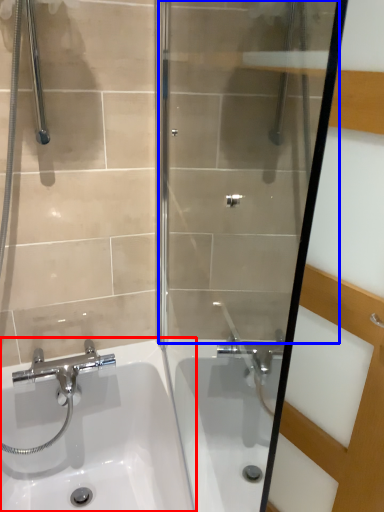
Question: Which object is further to the camera taking this photo, sink (highlighted by a red box) or shower door (highlighted by a blue box)?

Choices:
 (A) sink
 (B) shower door

Answer: (A)